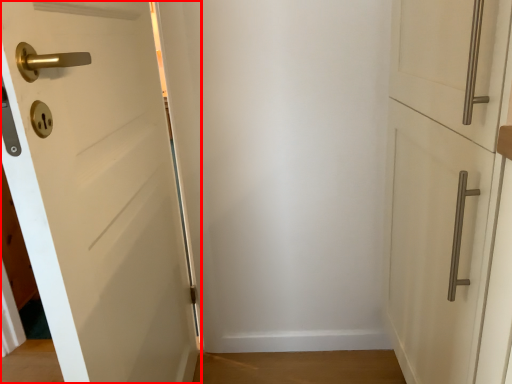
Question: From the image's perspective, what is the correct spatial positioning of door (annotated by the red box) in reference to door?

Choices:
 (A) below
 (B) above

Answer: (A)